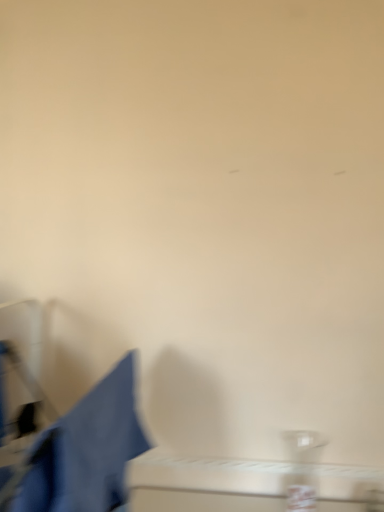
Measure the distance between blue fabric swivel chair at lower left and camera.

30.26 inches.

This screenshot has height=512, width=384. In order to click on blue fabric swivel chair at lower left in this screenshot , I will do `click(85, 451)`.

What do you see at coordinates (85, 451) in the screenshot? I see `blue fabric swivel chair at lower left` at bounding box center [85, 451].

The height and width of the screenshot is (512, 384). What are the coordinates of `blue fabric swivel chair at lower left` in the screenshot? It's located at (85, 451).